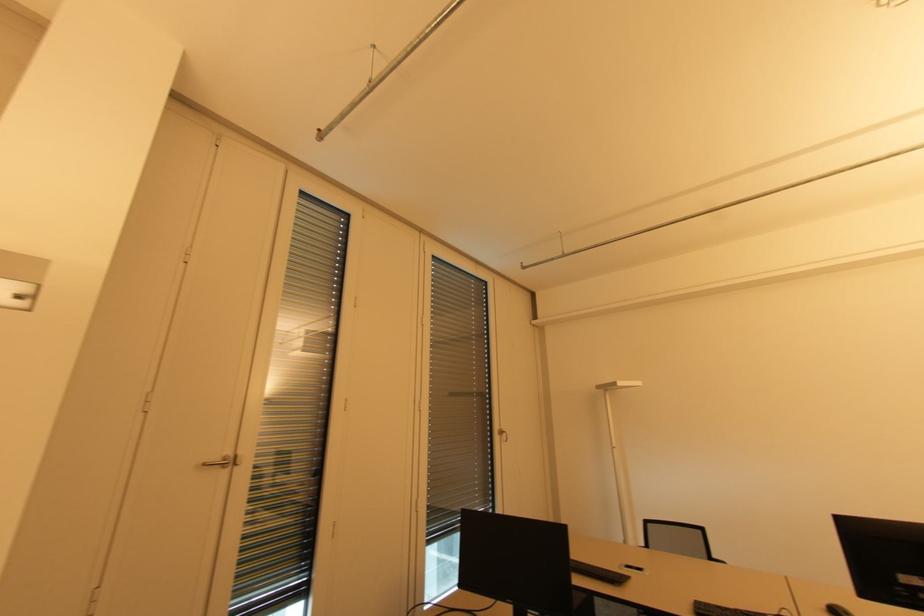
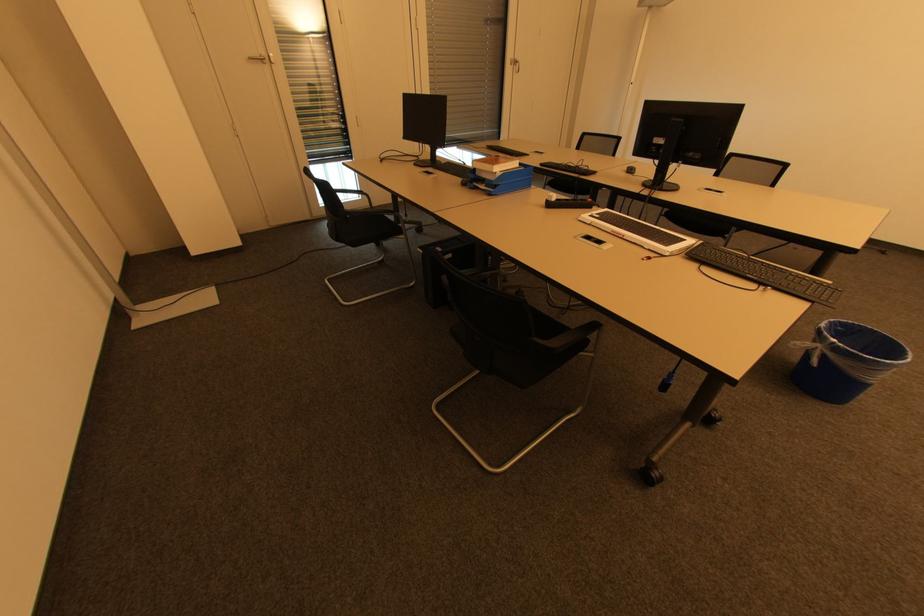
The point at (219, 458) is marked in the first image. Where is the corresponding point in the second image?

(258, 55)